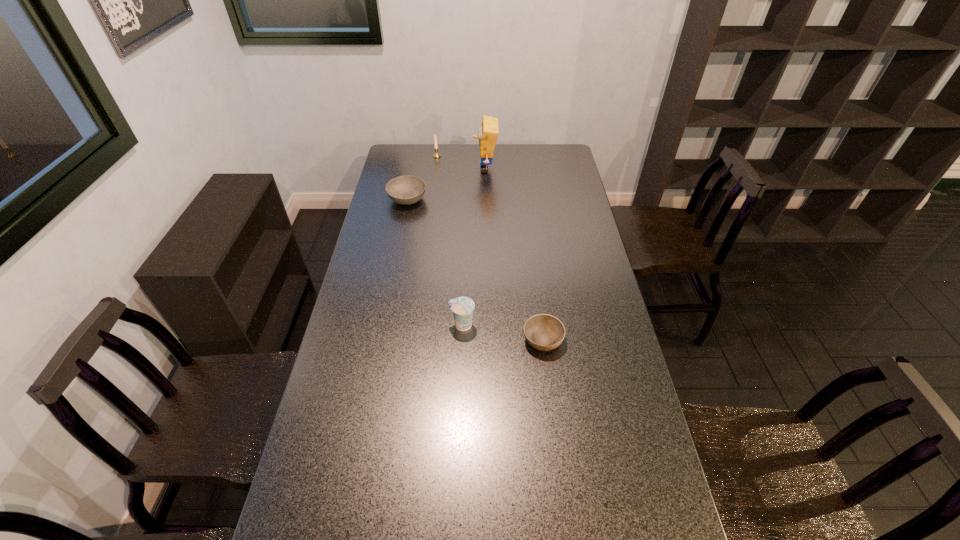
Locate an element on the screen. free point between the candle holder and the third shortest object is located at coordinates (449, 241).

Identify the location of free point between the yogurt and the second tallest object. The height and width of the screenshot is (540, 960). (449, 241).

Identify the location of unoccupied position between the third farthest object and the third tallest object. (435, 262).

Locate an element on the screen. Image resolution: width=960 pixels, height=540 pixels. blank region between the yogurt and the candle holder is located at coordinates point(449,241).

Where is `vacant space in between the right bowl and the fourth tallest object`? Image resolution: width=960 pixels, height=540 pixels. vacant space in between the right bowl and the fourth tallest object is located at coordinates (475, 269).

This screenshot has height=540, width=960. I want to click on vacant space that's between the shortest object and the farther bowl, so click(x=475, y=269).

Find the location of a particular element. The width and height of the screenshot is (960, 540). unoccupied position between the tallest object and the fourth shortest object is located at coordinates (461, 163).

Locate which object is the closest to the fourth shortest object. Please provide its 2D coordinates. Your answer should be formatted as a tuple, i.e. [(x, y)], where the tuple contains the x and y coordinates of a point satisfying the conditions above.

[(488, 132)]

Locate which object ranks in proximity to the farther bowl. Please provide its 2D coordinates. Your answer should be formatted as a tuple, i.e. [(x, y)], where the tuple contains the x and y coordinates of a point satisfying the conditions above.

[(488, 132)]

Choose which bowl is the second nearest neighbor to the candle holder. Please provide its 2D coordinates. Your answer should be formatted as a tuple, i.e. [(x, y)], where the tuple contains the x and y coordinates of a point satisfying the conditions above.

[(544, 332)]